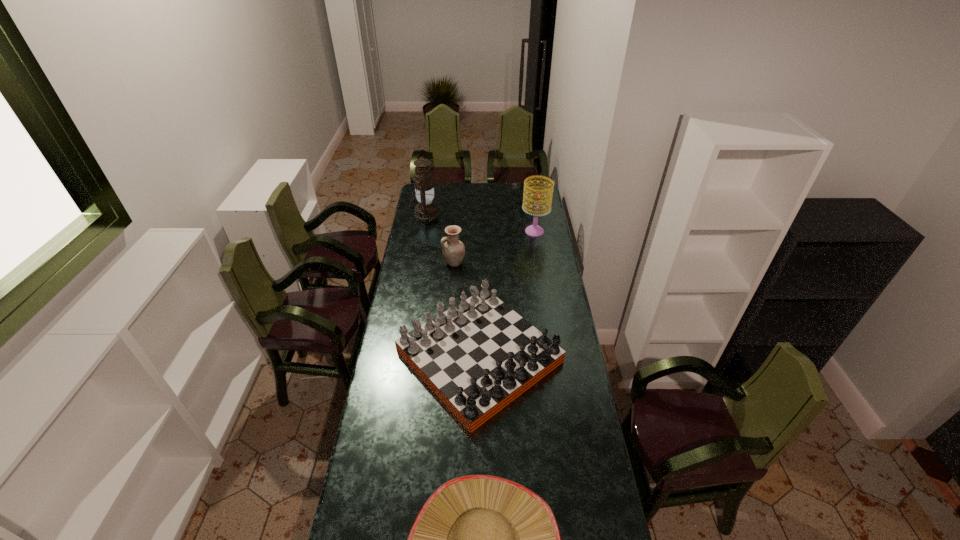
Choose which object is the fourth nearest neighbor to the sunhat. Please provide its 2D coordinates. Your answer should be formatted as a tuple, i.e. [(x, y)], where the tuple contains the x and y coordinates of a point satisfying the conditions above.

[(426, 211)]

At what (x,y) coordinates should I click in order to perform the action: click on vacant area in the image that satisfies the following two spatial constraints: 1. on the front side of the third tallest object; 2. on the left side of the second nearest object. Please return your answer as a coordinate pair (x, y). This screenshot has width=960, height=540. Looking at the image, I should click on (447, 356).